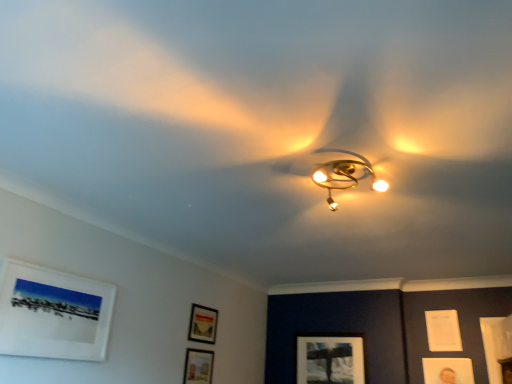
Image resolution: width=512 pixels, height=384 pixels. What do you see at coordinates (198, 366) in the screenshot?
I see `matte black picture frame at lower center, acting as the fifth picture frame starting from the right` at bounding box center [198, 366].

Where is `matte black picture frame at lower center, placed as the 2th picture frame when sorted from front to back`? The height and width of the screenshot is (384, 512). matte black picture frame at lower center, placed as the 2th picture frame when sorted from front to back is located at coordinates (198, 366).

You are a GUI agent. You are given a task and a screenshot of the screen. Output one action in this format:
    pyautogui.click(x=<x>, y=<y>)
    Task: Click on the matte gold picture frame at lower right, the 3th picture frame when ordered from back to front
    Image resolution: width=512 pixels, height=384 pixels.
    Given the screenshot: What is the action you would take?
    pyautogui.click(x=448, y=370)

Where is `gold metallic chandelier at center`? This screenshot has width=512, height=384. gold metallic chandelier at center is located at coordinates (344, 174).

Describe the element at coordinates (203, 324) in the screenshot. I see `matte black picture frame at lower center, the 3th picture frame from the front` at that location.

This screenshot has width=512, height=384. What do you see at coordinates (268, 129) in the screenshot?
I see `gold metallic fan at center` at bounding box center [268, 129].

Identify the location of matte black picture frame at lower center, which is counted as the 2th picture frame, starting from the left. 198,366.

Which is in front, point (318, 178) or point (259, 117)?

Positioned in front is point (259, 117).

Find the location of a particular element. The height and width of the screenshot is (384, 512). lamp located on the right of gold metallic fan at center is located at coordinates tap(344, 174).

Does gold metallic chandelier at center have a greater width compared to gold metallic fan at center?

In fact, gold metallic chandelier at center might be narrower than gold metallic fan at center.

Based on the photo, which of these two, gold metallic chandelier at center or gold metallic fan at center, stands shorter?

With less height is gold metallic fan at center.

From a real-world perspective, is matte white picture frame at lower center, which is the third picture frame from right to left, above or below white paper at upper right, the 1th picture frame from the right?

matte white picture frame at lower center, which is the third picture frame from right to left, is situated lower than white paper at upper right, the 1th picture frame from the right, in the real world.

Does matte white picture frame at lower center, which is the third picture frame from right to left, have a smaller size compared to white paper at upper right, the 2th picture frame from the back?

Actually, matte white picture frame at lower center, which is the third picture frame from right to left, might be larger than white paper at upper right, the 2th picture frame from the back.

Is white paper at upper right, which appears as the fifth picture frame when viewed from the front, a part of matte white picture frame at lower center, the 6th picture frame positioned from the front?

No, white paper at upper right, which appears as the fifth picture frame when viewed from the front, is not a part of matte white picture frame at lower center, the 6th picture frame positioned from the front.

Locate an element on the screen. picture frame located behind the white paper at upper right, which is the sixth picture frame from left to right is located at coordinates (330, 360).

Is matte black picture frame at lower center, placed as the 2th picture frame when sorted from front to back, to the left or to the right of gold metallic fan at center in the image?

In the image, matte black picture frame at lower center, placed as the 2th picture frame when sorted from front to back, appears on the left side of gold metallic fan at center.

Is matte black picture frame at lower center, acting as the fifth picture frame starting from the right, facing away from gold metallic fan at center?

matte black picture frame at lower center, acting as the fifth picture frame starting from the right, is not turned away from gold metallic fan at center.

Can you confirm if matte black picture frame at lower center, which is the 5th picture frame from back to front, is shorter than gold metallic fan at center?

Incorrect, the height of matte black picture frame at lower center, which is the 5th picture frame from back to front, does not fall short of that of gold metallic fan at center.

How many degrees apart are the facing directions of matte black picture frame at lower center, which is counted as the 2th picture frame, starting from the left, and gold metallic fan at center?

90 degrees.

Is white paper at upper right, the 2th picture frame from the back, inside or outside of matte gold picture frame at lower right, placed as the fifth picture frame when sorted from left to right?

white paper at upper right, the 2th picture frame from the back, exists outside the volume of matte gold picture frame at lower right, placed as the fifth picture frame when sorted from left to right.

From a real-world perspective, does white paper at upper right, the 2th picture frame from the back, sit lower than matte gold picture frame at lower right, which is the 4th picture frame from front to back?

No, from a real-world perspective, white paper at upper right, the 2th picture frame from the back, is not under matte gold picture frame at lower right, which is the 4th picture frame from front to back.

Based on their sizes in the image, would you say white paper at upper right, which is the sixth picture frame from left to right, is bigger or smaller than matte gold picture frame at lower right, the 3th picture frame when ordered from back to front?

white paper at upper right, which is the sixth picture frame from left to right, is bigger than matte gold picture frame at lower right, the 3th picture frame when ordered from back to front.

Which point is more forward, (445, 324) or (467, 380)?

The point (467, 380) is closer to the camera.

Which is in front, matte black picture frame at lower center, acting as the fifth picture frame starting from the right, or matte gold picture frame at lower right, positioned as the second picture frame in right-to-left order?

Positioned in front is matte black picture frame at lower center, acting as the fifth picture frame starting from the right.

Is matte black picture frame at lower center, acting as the fifth picture frame starting from the right, oriented towards matte gold picture frame at lower right, placed as the fifth picture frame when sorted from left to right?

No.

How far apart are matte black picture frame at lower center, placed as the 2th picture frame when sorted from front to back, and matte gold picture frame at lower right, the 3th picture frame when ordered from back to front?

6.90 feet.

Is there a large distance between matte black picture frame at lower center, placed as the 2th picture frame when sorted from front to back, and matte gold picture frame at lower right, positioned as the second picture frame in right-to-left order?

Yes, matte black picture frame at lower center, placed as the 2th picture frame when sorted from front to back, and matte gold picture frame at lower right, positioned as the second picture frame in right-to-left order, are quite far apart.

Does gold metallic fan at center lie in front of gold metallic chandelier at center?

Yes, it is in front of gold metallic chandelier at center.

Considering the relative sizes of gold metallic fan at center and gold metallic chandelier at center in the image provided, is gold metallic fan at center thinner than gold metallic chandelier at center?

In fact, gold metallic fan at center might be wider than gold metallic chandelier at center.

From the image's perspective, which is above, gold metallic fan at center or gold metallic chandelier at center?

gold metallic chandelier at center is shown above in the image.

Is matte white picture frame at lower center, which is the 4th picture frame in left-to-right order, taller than gold metallic fan at center?

Yes.

Can you confirm if matte white picture frame at lower center, acting as the 1th picture frame starting from the back, is wider than gold metallic fan at center?

No.

Is matte white picture frame at lower center, acting as the 1th picture frame starting from the back, positioned with its back to gold metallic fan at center?

No, matte white picture frame at lower center, acting as the 1th picture frame starting from the back, is not facing away from gold metallic fan at center.

From a real-world perspective, is matte white picture frame at lower center, which is the third picture frame from right to left, on gold metallic fan at center?

Incorrect, from a real-world perspective, matte white picture frame at lower center, which is the third picture frame from right to left, is lower than gold metallic fan at center.

This screenshot has height=384, width=512. In order to click on lamp above the gold metallic fan at center (from the image's perspective) in this screenshot , I will do `click(344, 174)`.

Find the location of `the 1st picture frame in front of the matte white picture frame at lower center, which is the third picture frame from right to left, counting from the anchor's position`. the 1st picture frame in front of the matte white picture frame at lower center, which is the third picture frame from right to left, counting from the anchor's position is located at coordinates (443, 331).

Based on their spatial positions, is white paper at upper right, which appears as the fifth picture frame when viewed from the front, or matte white picture frame at lower center, the 6th picture frame positioned from the front, further from white matte picture frame at upper left, the first picture frame from the left?

white paper at upper right, which appears as the fifth picture frame when viewed from the front, is positioned further to the anchor white matte picture frame at upper left, the first picture frame from the left.

When comparing their distances from matte black picture frame at lower center, which is the fourth picture frame in right-to-left order, does gold metallic chandelier at center or matte black picture frame at lower center, acting as the fifth picture frame starting from the right, seem closer?

matte black picture frame at lower center, acting as the fifth picture frame starting from the right, is positioned closer to the anchor matte black picture frame at lower center, which is the fourth picture frame in right-to-left order.

Based on their spatial positions, is matte black picture frame at lower center, acting as the fifth picture frame starting from the right, or matte black picture frame at lower center, the fourth picture frame in the back-to-front sequence, closer to matte gold picture frame at lower right, positioned as the second picture frame in right-to-left order?

matte black picture frame at lower center, the fourth picture frame in the back-to-front sequence, is positioned closer to the anchor matte gold picture frame at lower right, positioned as the second picture frame in right-to-left order.

When comparing their distances from gold metallic fan at center, does matte gold picture frame at lower right, which is the 4th picture frame from front to back, or gold metallic chandelier at center seem further?

Among the two, matte gold picture frame at lower right, which is the 4th picture frame from front to back, is located further to gold metallic fan at center.

When comparing their distances from white paper at upper right, which appears as the fifth picture frame when viewed from the front, does white matte picture frame at upper left, the first picture frame from the left, or gold metallic fan at center seem closer?

gold metallic fan at center is closer to white paper at upper right, which appears as the fifth picture frame when viewed from the front.

Based on their spatial positions, is matte black picture frame at lower center, which is the 5th picture frame from back to front, or matte gold picture frame at lower right, which is the 4th picture frame from front to back, further from white matte picture frame at upper left, placed as the 6th picture frame when sorted from right to left?

Based on the image, matte gold picture frame at lower right, which is the 4th picture frame from front to back, appears to be further to white matte picture frame at upper left, placed as the 6th picture frame when sorted from right to left.

When comparing their distances from matte black picture frame at lower center, which is the fourth picture frame in right-to-left order, does white matte picture frame at upper left, placed as the first picture frame when sorted from front to back, or gold metallic fan at center seem further?

The object further to matte black picture frame at lower center, which is the fourth picture frame in right-to-left order, is gold metallic fan at center.

Considering their positions, is white matte picture frame at upper left, which is the 6th picture frame in back-to-front order, positioned further to matte black picture frame at lower center, which is the fourth picture frame in right-to-left order, than matte gold picture frame at lower right, placed as the fifth picture frame when sorted from left to right?

matte gold picture frame at lower right, placed as the fifth picture frame when sorted from left to right, lies further to matte black picture frame at lower center, which is the fourth picture frame in right-to-left order, than the other object.

This screenshot has width=512, height=384. What are the coordinates of `picture frame situated between matte white picture frame at lower center, acting as the 1th picture frame starting from the back, and white paper at upper right, the 1th picture frame from the right, from left to right` in the screenshot? It's located at (448, 370).

This screenshot has width=512, height=384. Find the location of `lamp positioned between gold metallic fan at center and matte black picture frame at lower center, acting as the 3th picture frame starting from the left, from near to far`. lamp positioned between gold metallic fan at center and matte black picture frame at lower center, acting as the 3th picture frame starting from the left, from near to far is located at coordinates (344, 174).

Where is `fan situated between white matte picture frame at upper left, which is the 6th picture frame in back-to-front order, and gold metallic chandelier at center from left to right`? fan situated between white matte picture frame at upper left, which is the 6th picture frame in back-to-front order, and gold metallic chandelier at center from left to right is located at coordinates (268, 129).

This screenshot has height=384, width=512. I want to click on lamp located between gold metallic fan at center and matte black picture frame at lower center, which is counted as the 2th picture frame, starting from the left, in the depth direction, so click(344, 174).